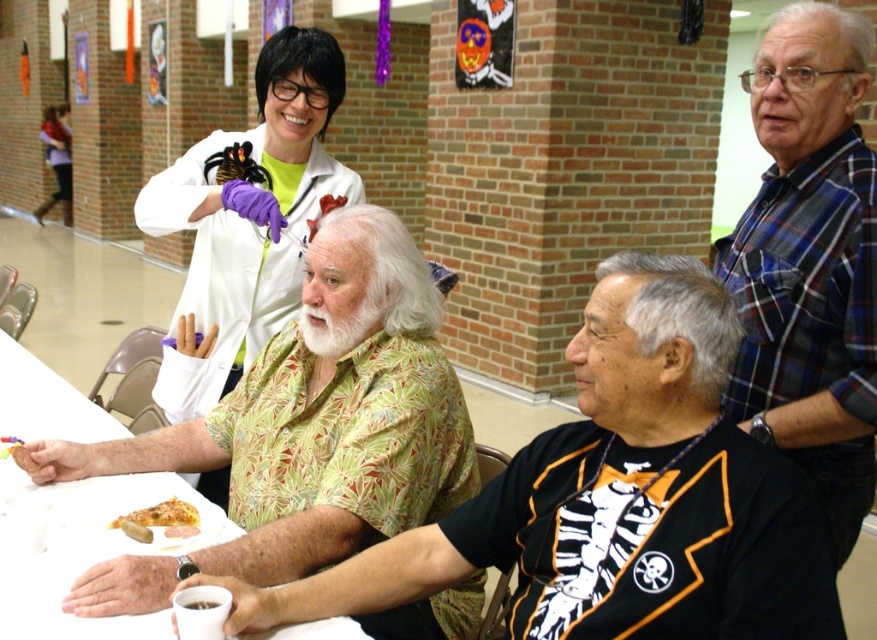
Question: Among these objects, which one is nearest to the camera?

Choices:
 (A) golden crispy pizza slice at lower center
 (B) blue plaid shirt at upper right

Answer: (B)

Question: Is white lab coat at upper center bigger than golden crispy pizza slice at lower left?

Choices:
 (A) yes
 (B) no

Answer: (A)

Question: From the image, what is the correct spatial relationship of blue plaid shirt at upper right in relation to matte white lab coat at upper left?

Choices:
 (A) above
 (B) below

Answer: (B)

Question: Can you confirm if green leafy shirt at center is wider than white lab coat at upper center?

Choices:
 (A) yes
 (B) no

Answer: (A)

Question: Which point appears closest to the camera in this image?

Choices:
 (A) click(x=424, y=554)
 (B) click(x=6, y=452)

Answer: (A)

Question: Which point appears closest to the camera in this image?

Choices:
 (A) (4, 458)
 (B) (279, 45)
 (C) (836, 77)
 (D) (58, 134)

Answer: (C)